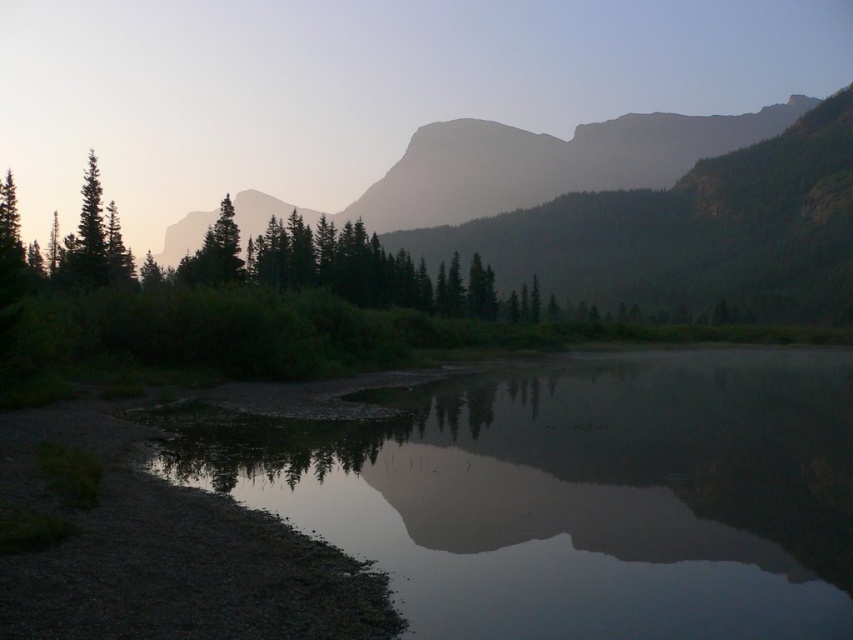
You are standing on the shoreline and want to take a photo of the smooth reflective water at center. Where should you position yourself to capture the reflection clearly?

You should position yourself at point (578, 496) to capture the smooth reflective water at center clearly.

You are an artist trying to paint this scene. You want to ensure the smooth reflective water at center and the green matte tree at left are proportionally accurate. Which object should you paint first if you want to start with the wider one?

The green matte tree at left is wider than the smooth reflective water at center, so you should start with the green matte tree at left.

You are standing at the point closer to the water in the image. Which point are you at, point (258,432) or point (102,209)?

Point (102,209) is closer to the water, so you are at point (102,209).